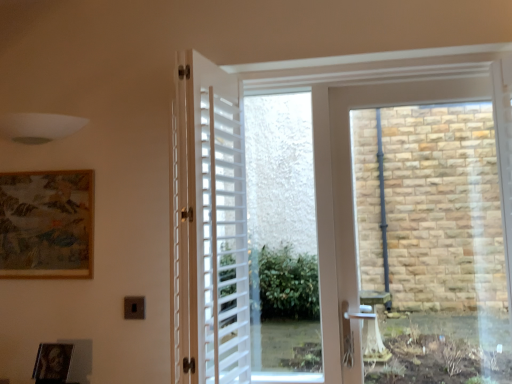
The width and height of the screenshot is (512, 384). I want to click on black matte picture frame at lower left, which is the 2th picture frame in back-to-front order, so coord(52,363).

This screenshot has height=384, width=512. What do you see at coordinates (46, 224) in the screenshot?
I see `wooden textured picture frame at upper left, the second picture frame from the bottom` at bounding box center [46, 224].

Image resolution: width=512 pixels, height=384 pixels. Find the location of `white matte shutter at center`. white matte shutter at center is located at coordinates (217, 226).

Are white plastic window screen at center and white matte shutter at center far apart?

white plastic window screen at center is actually quite close to white matte shutter at center.

Is white plastic window screen at center wider or thinner than white matte shutter at center?

In the image, white plastic window screen at center appears to be more narrow than white matte shutter at center.

Between point (300, 290) and point (199, 297), which one is positioned in front?

Point (199, 297)

Between white plastic window screen at center and white matte shutter at center, which one is positioned behind?

white plastic window screen at center is more distant.

Between black matte picture frame at lower left, the 1th picture frame from the front, and white plastic window screen at center, which one has smaller size?

black matte picture frame at lower left, the 1th picture frame from the front, is smaller.

From the image's perspective, which one is positioned higher, black matte picture frame at lower left, the second picture frame viewed from the top, or white plastic window screen at center?

white plastic window screen at center appears higher in the image.

Considering the sizes of objects black matte picture frame at lower left, the 1th picture frame ordered from the bottom, and white plastic window screen at center in the image provided, who is wider, black matte picture frame at lower left, the 1th picture frame ordered from the bottom, or white plastic window screen at center?

With larger width is white plastic window screen at center.

Who is shorter, black matte picture frame at lower left, the 1th picture frame from the front, or white plastic window screen at center?

black matte picture frame at lower left, the 1th picture frame from the front, is shorter.

Where is `door above the wooden textured picture frame at upper left, the second picture frame from the bottom (from the image's perspective)`? The height and width of the screenshot is (384, 512). door above the wooden textured picture frame at upper left, the second picture frame from the bottom (from the image's perspective) is located at coordinates (217, 226).

Who is more distant, wooden textured picture frame at upper left, the second picture frame from the front, or white matte shutter at center?

wooden textured picture frame at upper left, the second picture frame from the front, is further from the camera.

Can you confirm if wooden textured picture frame at upper left, acting as the first picture frame starting from the top, is wider than white matte shutter at center?

Incorrect, the width of wooden textured picture frame at upper left, acting as the first picture frame starting from the top, does not surpass that of white matte shutter at center.

Where is `picture frame located underneath the white matte shutter at center (from a real-world perspective)`? Image resolution: width=512 pixels, height=384 pixels. picture frame located underneath the white matte shutter at center (from a real-world perspective) is located at coordinates (52, 363).

Choose the correct answer: Is white matte shutter at center inside black matte picture frame at lower left, the second picture frame viewed from the top, or outside it?

white matte shutter at center is spatially situated outside black matte picture frame at lower left, the second picture frame viewed from the top.

Is point (192, 352) positioned before point (39, 347)?

Yes, it is.

Is point (307, 203) less distant than point (56, 237)?

No, (307, 203) is further to viewer.

Measure the distance between white plastic window screen at center and wooden textured picture frame at upper left, which is the first picture frame in back-to-front order.

white plastic window screen at center is 1.15 meters from wooden textured picture frame at upper left, which is the first picture frame in back-to-front order.

The width and height of the screenshot is (512, 384). What are the coordinates of `window screen below the wooden textured picture frame at upper left, acting as the first picture frame starting from the top (from a real-world perspective)` in the screenshot? It's located at (x=282, y=237).

Is white plastic window screen at center at the right side of wooden textured picture frame at upper left, the second picture frame from the bottom?

Yes.

Does white matte shutter at center have a lesser height compared to white plastic window screen at center?

Yes.

Is white matte shutter at center not close to white plastic window screen at center?

white matte shutter at center is actually quite close to white plastic window screen at center.

Consider the image. Considering the sizes of white matte shutter at center and white plastic window screen at center in the image, is white matte shutter at center wider or thinner than white plastic window screen at center?

white matte shutter at center is wider than white plastic window screen at center.

Looking at this image, do you think white matte shutter at center is within white plastic window screen at center, or outside of it?

white matte shutter at center exists outside the volume of white plastic window screen at center.

Is white plastic window screen at center a part of wooden textured picture frame at upper left, which is the first picture frame in back-to-front order?

No, white plastic window screen at center is not a part of wooden textured picture frame at upper left, which is the first picture frame in back-to-front order.

In terms of width, does wooden textured picture frame at upper left, the second picture frame from the front, look wider or thinner when compared to white plastic window screen at center?

wooden textured picture frame at upper left, the second picture frame from the front, is thinner than white plastic window screen at center.

Which object is positioned more to the left, wooden textured picture frame at upper left, which is the first picture frame in back-to-front order, or white plastic window screen at center?

Positioned to the left is wooden textured picture frame at upper left, which is the first picture frame in back-to-front order.

Could you tell me if wooden textured picture frame at upper left, the second picture frame from the front, is facing white plastic window screen at center?

No, wooden textured picture frame at upper left, the second picture frame from the front, is not facing towards white plastic window screen at center.

Identify the location of window screen below the white matte shutter at center (from the image's perspective). (282, 237).

There is a black matte picture frame at lower left, the 1th picture frame from the front. At what (x,y) coordinates should I click in order to perform the action: click on window screen above it (from a real-world perspective). Please return your answer as a coordinate pair (x, y). Looking at the image, I should click on (282, 237).

Looking at the image, which one is located further to black matte picture frame at lower left, the 1th picture frame ordered from the bottom, wooden textured picture frame at upper left, the second picture frame from the bottom, or white plastic window screen at center?

The object further to black matte picture frame at lower left, the 1th picture frame ordered from the bottom, is white plastic window screen at center.

Estimate the real-world distances between objects in this image. Which object is further from black matte picture frame at lower left, the 1th picture frame from the front, wooden textured picture frame at upper left, which is the first picture frame in back-to-front order, or white matte shutter at center?

The object further to black matte picture frame at lower left, the 1th picture frame from the front, is white matte shutter at center.

Which object lies nearer to the anchor point white matte shutter at center, white plastic window screen at center or wooden textured picture frame at upper left, which is the first picture frame in back-to-front order?

wooden textured picture frame at upper left, which is the first picture frame in back-to-front order, is closer to white matte shutter at center.

Considering their positions, is black matte picture frame at lower left, the 1th picture frame from the front, positioned closer to white matte shutter at center than white plastic window screen at center?

→ black matte picture frame at lower left, the 1th picture frame from the front, is closer to white matte shutter at center.

When comparing their distances from white plastic window screen at center, does black matte picture frame at lower left, the 1th picture frame from the front, or wooden textured picture frame at upper left, the second picture frame from the front, seem further?

black matte picture frame at lower left, the 1th picture frame from the front.

Estimate the real-world distances between objects in this image. Which object is closer to wooden textured picture frame at upper left, acting as the first picture frame starting from the top, white plastic window screen at center or white matte shutter at center?

Among the two, white matte shutter at center is located nearer to wooden textured picture frame at upper left, acting as the first picture frame starting from the top.

From the image, which object appears to be nearer to wooden textured picture frame at upper left, which is the first picture frame in back-to-front order, black matte picture frame at lower left, the 1th picture frame from the front, or white plastic window screen at center?

black matte picture frame at lower left, the 1th picture frame from the front, lies closer to wooden textured picture frame at upper left, which is the first picture frame in back-to-front order, than the other object.

Looking at the image, which one is located further to black matte picture frame at lower left, the second picture frame viewed from the top, white matte shutter at center or white plastic window screen at center?

white plastic window screen at center is further to black matte picture frame at lower left, the second picture frame viewed from the top.

Where is `picture frame between wooden textured picture frame at upper left, which is the first picture frame in back-to-front order, and white plastic window screen at center`? picture frame between wooden textured picture frame at upper left, which is the first picture frame in back-to-front order, and white plastic window screen at center is located at coordinates (52, 363).

This screenshot has height=384, width=512. What are the coordinates of `door situated between black matte picture frame at lower left, the second picture frame viewed from the top, and white plastic window screen at center from left to right` in the screenshot? It's located at pos(217,226).

Locate an element on the screen. door located between wooden textured picture frame at upper left, the second picture frame from the bottom, and white plastic window screen at center in the left-right direction is located at coordinates click(x=217, y=226).

I want to click on picture frame between wooden textured picture frame at upper left, which is the first picture frame in back-to-front order, and white matte shutter at center, so click(52, 363).